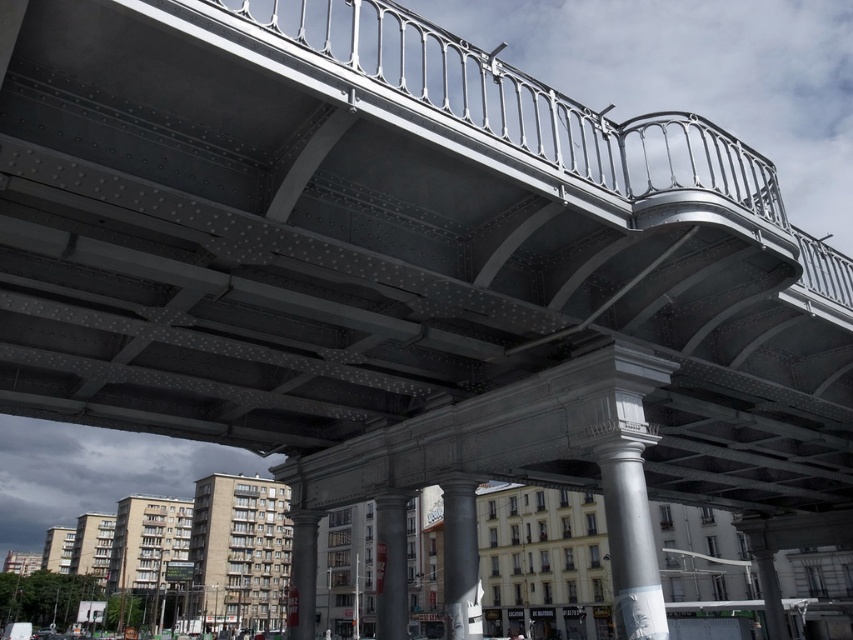
Question: Which point is farther from the camera taking this photo?

Choices:
 (A) (440, 486)
 (B) (305, 552)
 (C) (404, 522)
 (D) (637, 602)

Answer: (B)

Question: Does smooth gray pillar at center have a larger size compared to smooth concrete pillar at center?

Choices:
 (A) yes
 (B) no

Answer: (A)

Question: Is white polished column at center to the left of smooth gray pillar at center from the viewer's perspective?

Choices:
 (A) yes
 (B) no

Answer: (B)

Question: Which point is closer to the camera taking this photo?

Choices:
 (A) (457, 600)
 (B) (300, 604)
 (C) (622, 522)
 (D) (378, 618)

Answer: (C)

Question: Where is smooth gray pillar at center located in relation to smooth concrete pillar at center in the image?

Choices:
 (A) below
 (B) above

Answer: (A)

Question: Based on their relative distances, which object is farther from the smooth concrete pillar at center?

Choices:
 (A) white polished column at center
 (B) white polished stone column at center

Answer: (A)